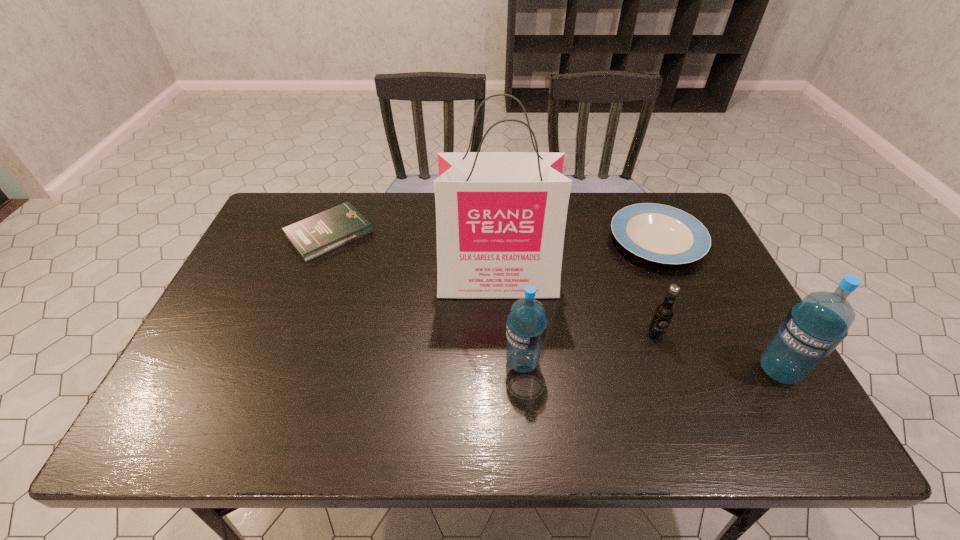
Locate an element on the screen. the left water bottle is located at coordinates (526, 325).

You are a GUI agent. You are given a task and a screenshot of the screen. Output one action in this format:
    pyautogui.click(x=<x>, y=<y>)
    Task: Click on the fourth shortest object
    This screenshot has width=960, height=540.
    Given the screenshot: What is the action you would take?
    pyautogui.click(x=526, y=325)

Locate an element on the screen. The width and height of the screenshot is (960, 540). the taller water bottle is located at coordinates (813, 328).

The height and width of the screenshot is (540, 960). Identify the location of the second tallest object. coord(813,328).

Image resolution: width=960 pixels, height=540 pixels. What are the coordinates of `the second shortest object` in the screenshot? It's located at (659, 233).

The width and height of the screenshot is (960, 540). I want to click on the tallest object, so click(500, 216).

This screenshot has height=540, width=960. In order to click on the fourth farthest object in this screenshot , I will do `click(662, 316)`.

Locate an element on the screen. The width and height of the screenshot is (960, 540). the fourth tallest object is located at coordinates (662, 316).

Find the location of a particular element. The width and height of the screenshot is (960, 540). book is located at coordinates (314, 236).

The height and width of the screenshot is (540, 960). I want to click on the shortest object, so [314, 236].